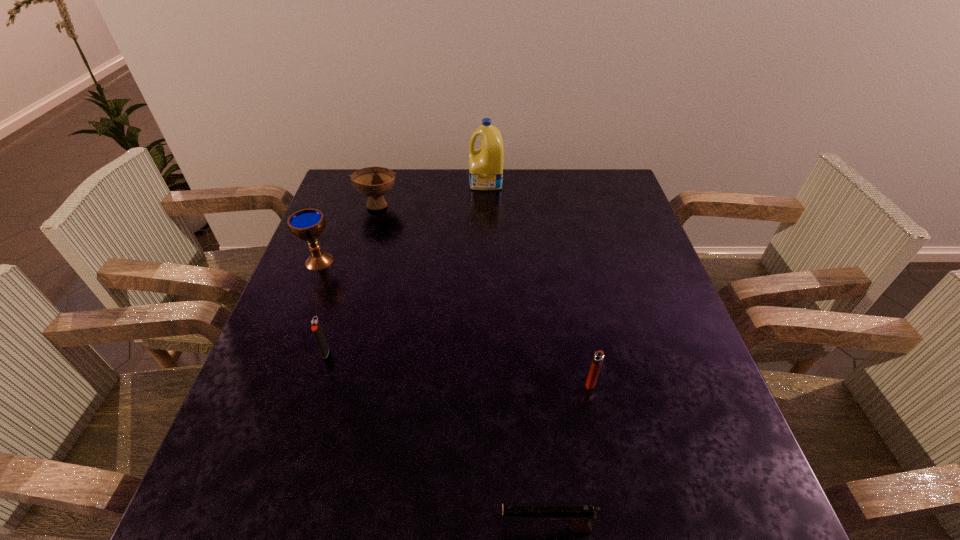
Locate an element on the screen. Image resolution: width=960 pixels, height=540 pixels. blank space at the near left corner is located at coordinates (230, 508).

In the image, there is a desktop. Identify the location of vacant space at the far right corner. (615, 180).

Identify the location of vacant area between the fourth farthest object and the right igniter. (458, 367).

Find the location of a particular element. Image resolution: width=960 pixels, height=540 pixels. free point between the chalice and the third nearest object is located at coordinates (323, 307).

Image resolution: width=960 pixels, height=540 pixels. Identify the location of free point between the pistol and the second tallest object. 433,395.

Locate an element on the screen. The image size is (960, 540). free space between the detergent and the chalice is located at coordinates (402, 222).

Where is `empty space between the right igniter and the third farthest object`? empty space between the right igniter and the third farthest object is located at coordinates (455, 322).

I want to click on free space between the farthest object and the third farthest object, so click(402, 222).

Where is `free space between the tallest object and the soup bowl`? free space between the tallest object and the soup bowl is located at coordinates (432, 193).

You are a GUI agent. You are given a task and a screenshot of the screen. Output one action in this format:
    pyautogui.click(x=<x>, y=<y>)
    Task: Click on the vacant space that is in between the right igniter and the chalice
    The height and width of the screenshot is (540, 960).
    Given the screenshot: What is the action you would take?
    pyautogui.click(x=455, y=322)